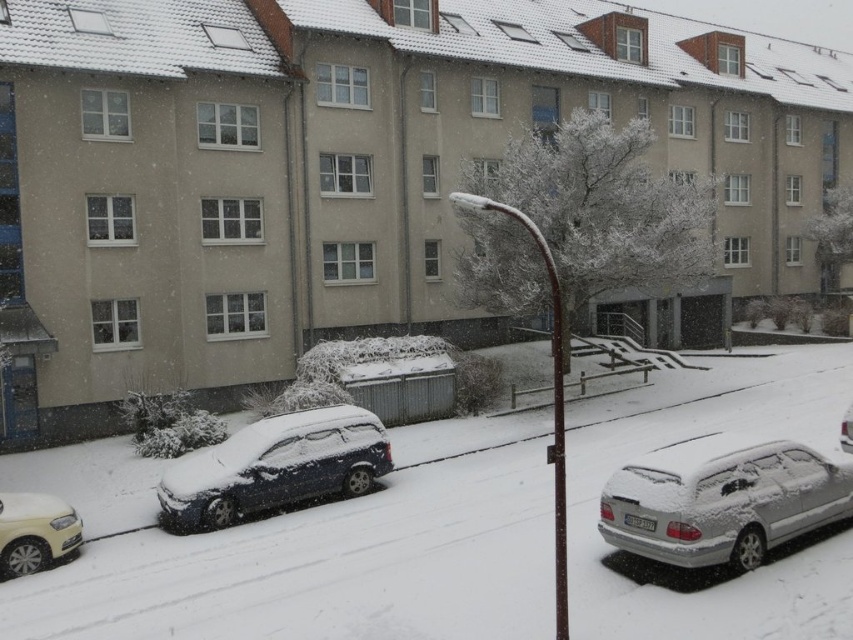
Does silver metallic car at lower right come in front of sleek metallic car at left?

Yes.

Can you confirm if silver metallic car at lower right is positioned below sleek metallic car at left?

Actually, silver metallic car at lower right is above sleek metallic car at left.

Does point (741, 492) lie in front of point (343, 426)?

Yes, it is in front of point (343, 426).

Locate an element on the screen. silver metallic car at lower right is located at coordinates (722, 499).

Is silver metallic car at lower right bigger than sleek silver sedan at center?

Yes, silver metallic car at lower right is bigger than sleek silver sedan at center.

Between point (784, 490) and point (843, 449), which one is positioned behind?

Positioned behind is point (843, 449).

Where is `silver metallic car at lower right`? This screenshot has width=853, height=640. silver metallic car at lower right is located at coordinates (722, 499).

Is sleek metallic car at left bigger than sleek silver sedan at center?

Correct, sleek metallic car at left is larger in size than sleek silver sedan at center.

Is sleek metallic car at left below sleek silver sedan at center?

Yes.

Where is `sleek metallic car at left`? sleek metallic car at left is located at coordinates (276, 467).

Locate an element on the screen. The height and width of the screenshot is (640, 853). sleek metallic car at left is located at coordinates (276, 467).